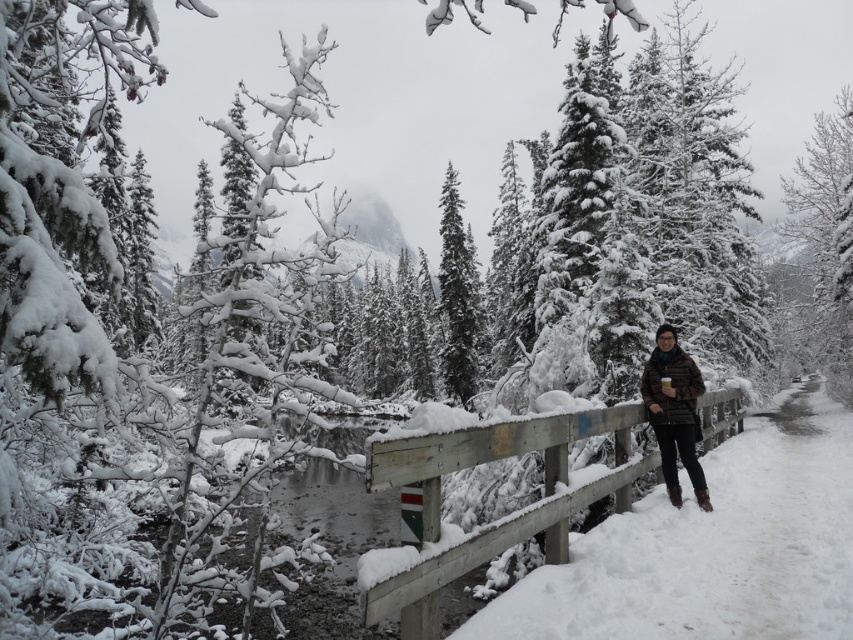
Question: Which point is closer to the camera?

Choices:
 (A) (476, 349)
 (B) (813, 248)
 (C) (660, 384)

Answer: (C)

Question: Which point is farther from the camera taking this photo?

Choices:
 (A) click(x=814, y=141)
 (B) click(x=669, y=388)

Answer: (A)

Question: Where is wooden fence at center located in relation to snow-covered evergreen at right in the image?

Choices:
 (A) left
 (B) right

Answer: (A)

Question: Is snow-covered evergreen at right bigger than snow-covered evergreen tree at center?

Choices:
 (A) no
 (B) yes

Answer: (B)

Question: Which object appears farthest from the camera in this image?

Choices:
 (A) brown fuzzy jacket at lower right
 (B) snow-covered evergreen tree at center
 (C) wooden fence at center
 (D) snow-covered evergreen at right

Answer: (B)

Question: Does wooden fence at center have a larger size compared to snow-covered evergreen tree at center?

Choices:
 (A) yes
 (B) no

Answer: (B)